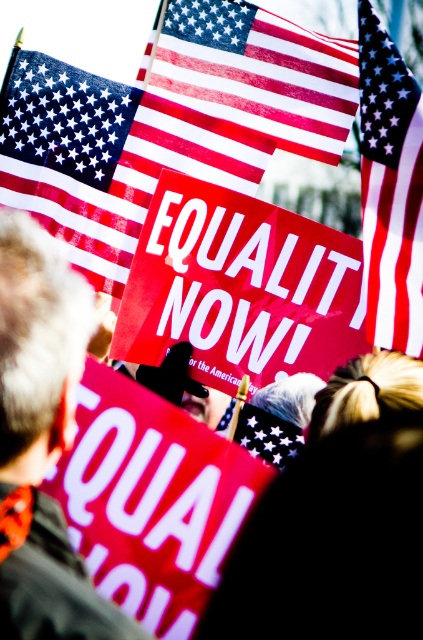
What are the coordinates of the gray hair at upper left in the image?

The gray hair at upper left is located at coordinates point (41, 440).

You are a photographer at the protest. You want to capture a photo that includes both the matte red flag at upper center and the matte fabric flag at upper right. Which flag should you focus on first to ensure both are in frame?

You should focus on the matte red flag at upper center first because it is larger and will require more space in the frame. By centering it and adjusting the camera angle, you can then include the smaller matte fabric flag at upper right in the composition.